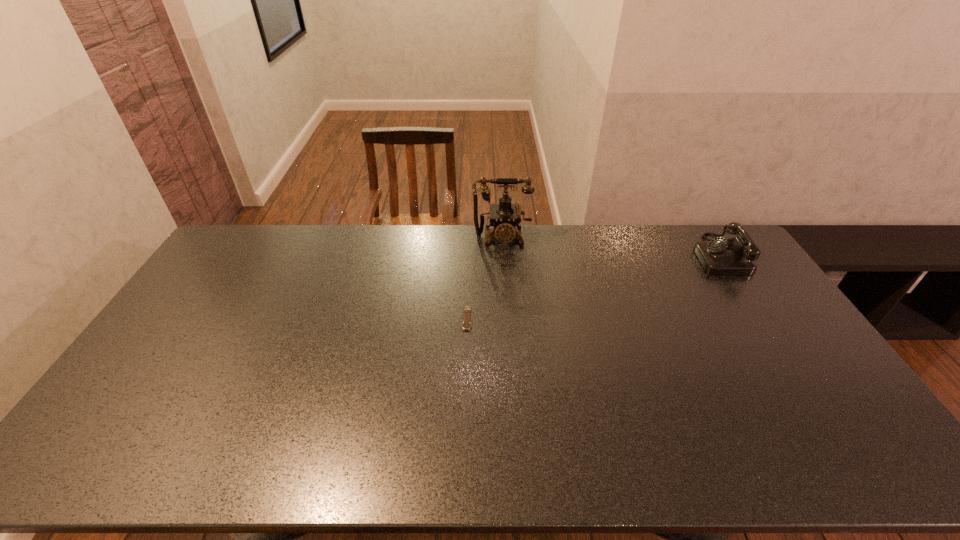
In order to click on empty space that is in between the left telephone and the shortest object in this screenshot , I will do `click(485, 279)`.

You are a GUI agent. You are given a task and a screenshot of the screen. Output one action in this format:
    pyautogui.click(x=<x>, y=<y>)
    Task: Click on the unoccupied position between the tallest object and the watch
    
    Given the screenshot: What is the action you would take?
    pyautogui.click(x=485, y=279)

Find the location of a particular element. This screenshot has width=960, height=540. free space between the taller telephone and the watch is located at coordinates (485, 279).

The image size is (960, 540). I want to click on empty space that is in between the watch and the left telephone, so click(485, 279).

The width and height of the screenshot is (960, 540). Identify the location of vacant area that lies between the tallest object and the right telephone. (610, 247).

Locate an element on the screen. Image resolution: width=960 pixels, height=540 pixels. free space that is in between the rightmost object and the shortest object is located at coordinates (592, 287).

Image resolution: width=960 pixels, height=540 pixels. Find the location of `empty space between the second shortest object and the left telephone`. empty space between the second shortest object and the left telephone is located at coordinates (610, 247).

At what (x,y) coordinates should I click in order to perform the action: click on vacant space that's between the taller telephone and the watch. Please return your answer as a coordinate pair (x, y). The width and height of the screenshot is (960, 540). Looking at the image, I should click on (485, 279).

Identify which object is located as the nearest to the watch. Please provide its 2D coordinates. Your answer should be formatted as a tuple, i.e. [(x, y)], where the tuple contains the x and y coordinates of a point satisfying the conditions above.

[(504, 216)]

Select which object appears as the closest to the left telephone. Please provide its 2D coordinates. Your answer should be formatted as a tuple, i.e. [(x, y)], where the tuple contains the x and y coordinates of a point satisfying the conditions above.

[(466, 325)]